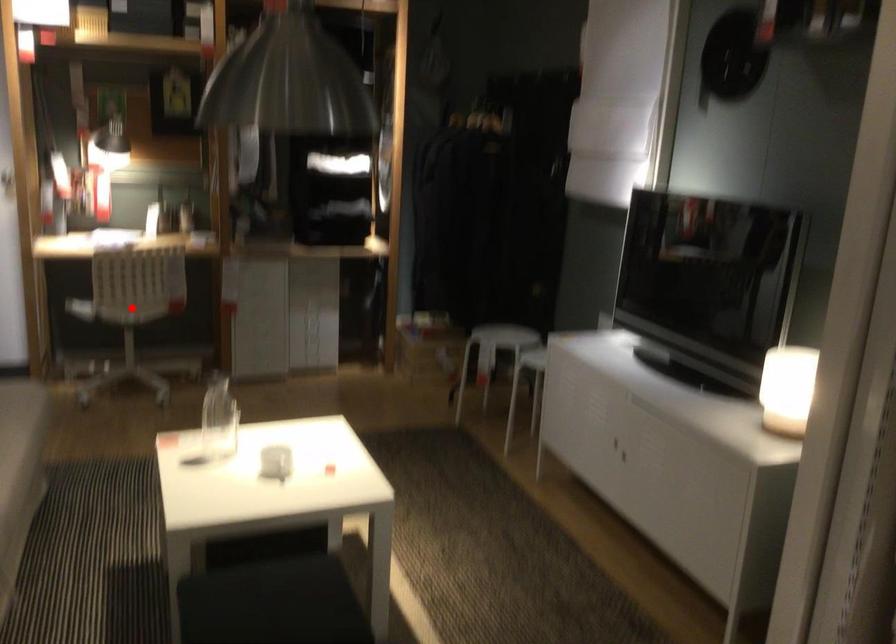
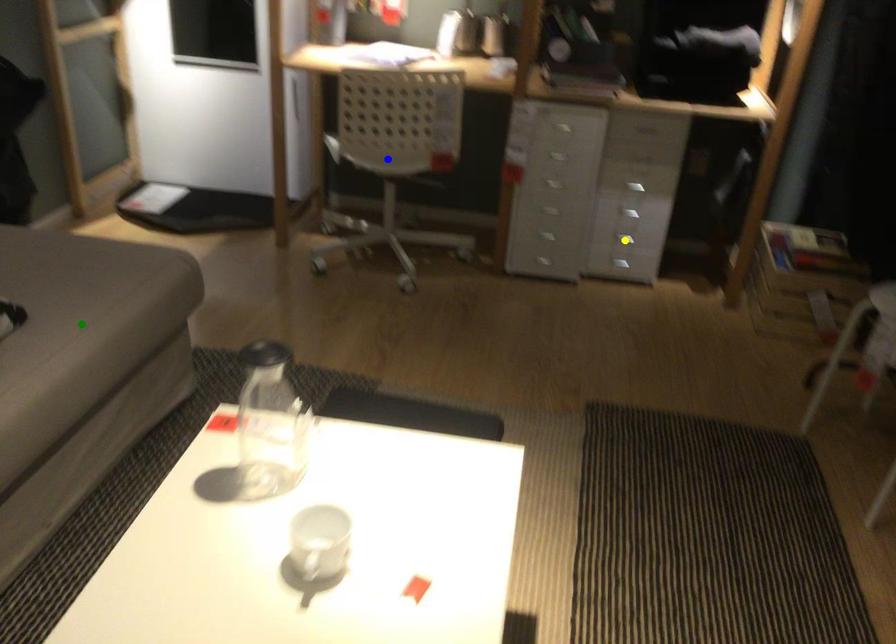
Question: I am providing you with two images of the same scene from different viewpoints. A red point is marked on the first image. You are given multiple points on the second image. Which point in image 2 is actually the same real-world point as the red point in image 1?

Choices:
 (A) blue point
 (B) green point
 (C) yellow point

Answer: (A)